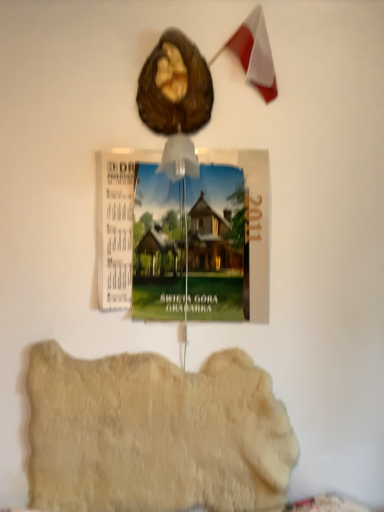
Question: Would you say shiny brown nut at upper center is inside or outside fuzzy beige rug at lower center?

Choices:
 (A) inside
 (B) outside

Answer: (B)

Question: From a real-world perspective, is shiny brown nut at upper center above or below fuzzy beige rug at lower center?

Choices:
 (A) above
 (B) below

Answer: (A)

Question: Which is farther from the shiny brown nut at upper center?

Choices:
 (A) fuzzy beige rug at lower center
 (B) wooden postcard at center

Answer: (A)

Question: Which of these objects is positioned farthest from the wooden postcard at center?

Choices:
 (A) shiny brown nut at upper center
 (B) fuzzy beige rug at lower center

Answer: (B)